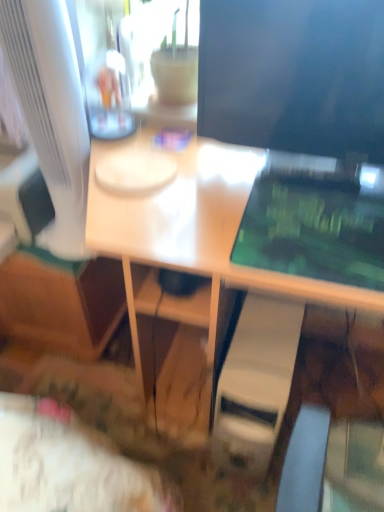
Find the location of `free space above white plastic computer tower at lower center (from a real-world perspective)`. free space above white plastic computer tower at lower center (from a real-world perspective) is located at coordinates (267, 346).